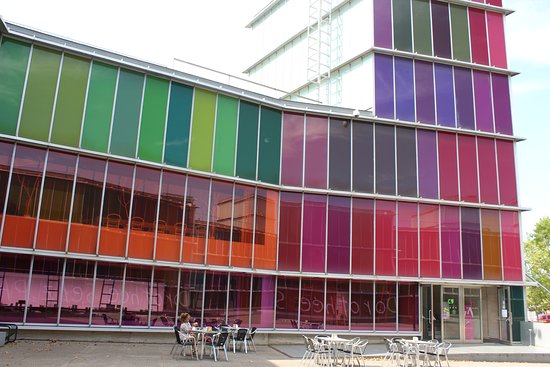
Where is `orange windows`? orange windows is located at coordinates (265, 250), (238, 256), (213, 257), (192, 253), (166, 252), (138, 248), (114, 243), (85, 239), (55, 237), (25, 233).